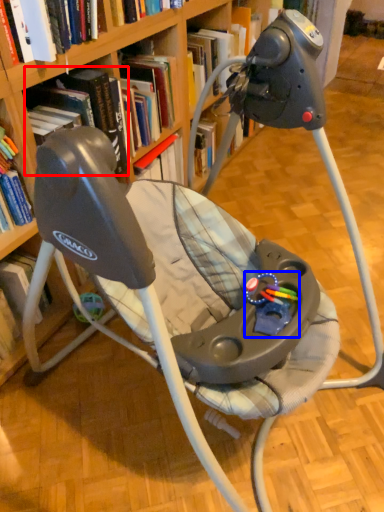
Question: Which object is further to the camera taking this photo, book (highlighted by a red box) or toy (highlighted by a blue box)?

Choices:
 (A) book
 (B) toy

Answer: (A)